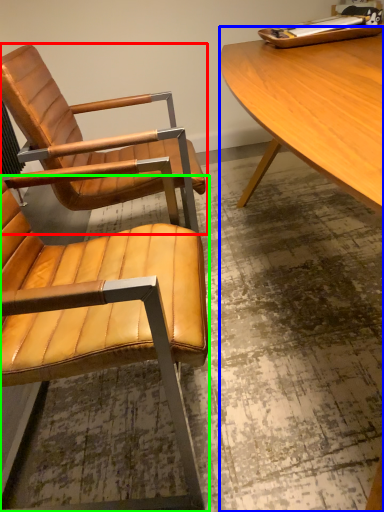
Question: Which object is positioned farthest from chair (highlighted by a red box)? Select from desk (highlighted by a blue box) and chair (highlighted by a green box).

Choices:
 (A) desk
 (B) chair

Answer: (A)